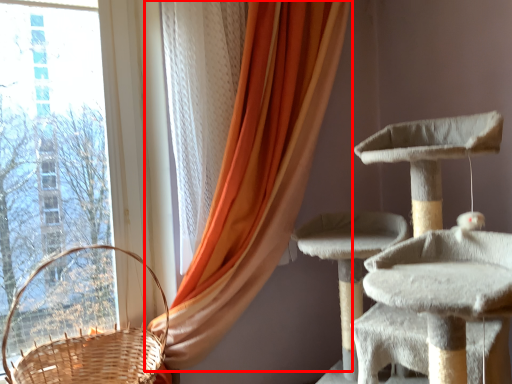
Question: From the image's perspective, considering the relative positions of curtain (annotated by the red box) and basket in the image provided, where is curtain (annotated by the red box) located with respect to the staircase?

Choices:
 (A) below
 (B) above

Answer: (B)